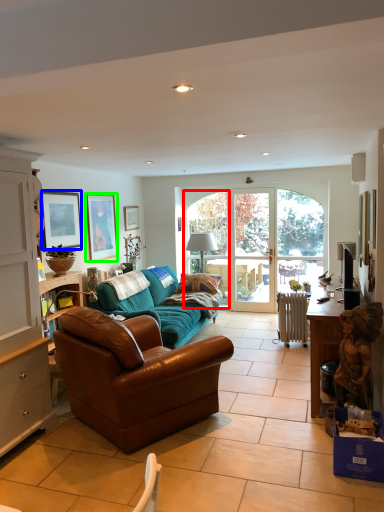
Question: Which object is the closest to the window (highlighted by a red box)? Choose among these: picture frame (highlighted by a blue box) or picture frame (highlighted by a green box).

Choices:
 (A) picture frame
 (B) picture frame

Answer: (B)